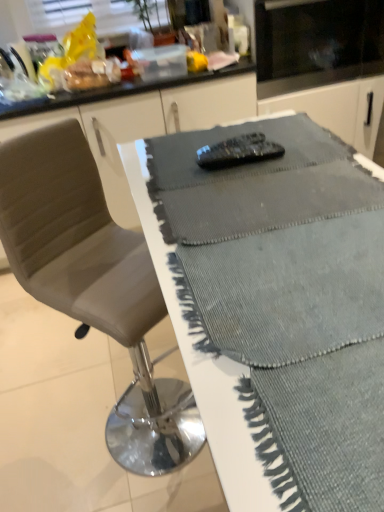
Where is `black glass microwave at upper center`? black glass microwave at upper center is located at coordinates (316, 42).

Locate an element on the screen. chair on the left side of black glass microwave at upper center is located at coordinates (95, 285).

Would you say leather-like gray chair at center is a long distance from black glass microwave at upper center?

Yes, leather-like gray chair at center and black glass microwave at upper center are located far from each other.

From a real-world perspective, is leather-like gray chair at center on top of black glass microwave at upper center?

No, from a real-world perspective, leather-like gray chair at center is not over black glass microwave at upper center

Is leather-like gray chair at center wider than textured gray table at center?

Correct, the width of leather-like gray chair at center exceeds that of textured gray table at center.

Considering the points (52, 204) and (321, 273), which point is behind, point (52, 204) or point (321, 273)?

The point (52, 204) is farther from the camera.

Who is taller, leather-like gray chair at center or textured gray table at center?

With more height is leather-like gray chair at center.

Considering the sizes of leather-like gray chair at center and textured gray table at center in the image, is leather-like gray chair at center bigger or smaller than textured gray table at center?

Considering their sizes, leather-like gray chair at center takes up more space than textured gray table at center.

Which point is more forward, (220, 463) or (300, 35)?

The point (220, 463) is in front.

From a real-world perspective, who is located lower, textured gray table at center or black glass microwave at upper center?

black glass microwave at upper center, from a real-world perspective.

Does textured gray table at center come in front of black glass microwave at upper center?

Yes, it is.

Between textured gray table at center and black glass microwave at upper center, which one has more height?

black glass microwave at upper center.

In order to click on appliance above the textured gray table at center (from the image's perspective) in this screenshot , I will do `click(316, 42)`.

Can you confirm if black glass microwave at upper center is shorter than textured gray table at center?

Incorrect, the height of black glass microwave at upper center does not fall short of that of textured gray table at center.

Which is in front, point (271, 33) or point (293, 471)?

The point (293, 471) is closer.

From a real-world perspective, relative to textured gray table at center, is black glass microwave at upper center vertically above or below?

In terms of real-world spatial position, black glass microwave at upper center is below textured gray table at center.

Is point (225, 210) closer to camera compared to point (140, 282)?

Yes, point (225, 210) is closer to viewer.

From the picture: Is textured gray table at center beside leather-like gray chair at center?

They are not placed beside each other.

Considering the sizes of objects textured gray table at center and leather-like gray chair at center in the image provided, who is wider, textured gray table at center or leather-like gray chair at center?

Wider between the two is leather-like gray chair at center.

Considering the relative sizes of black glass microwave at upper center and leather-like gray chair at center in the image provided, is black glass microwave at upper center thinner than leather-like gray chair at center?

Yes, black glass microwave at upper center is thinner than leather-like gray chair at center.

Based on the photo, how many degrees apart are the facing directions of black glass microwave at upper center and leather-like gray chair at center?

They differ by 90.4 degrees in their facing directions.

Is black glass microwave at upper center far away from leather-like gray chair at center?

black glass microwave at upper center is far away from leather-like gray chair at center.

Is black glass microwave at upper center in front of leather-like gray chair at center?

No, black glass microwave at upper center is further to the viewer.

Locate an element on the screen. The width and height of the screenshot is (384, 512). chair beneath the black glass microwave at upper center (from a real-world perspective) is located at coordinates pos(95,285).

There is a leather-like gray chair at center. Find the location of `table above it (from a real-world perspective)`. table above it (from a real-world perspective) is located at coordinates (276, 310).

When comparing their distances from textured gray table at center, does black glass microwave at upper center or leather-like gray chair at center seem closer?

Among the two, leather-like gray chair at center is located nearer to textured gray table at center.

Estimate the real-world distances between objects in this image. Which object is further from leather-like gray chair at center, black glass microwave at upper center or textured gray table at center?

black glass microwave at upper center is positioned further to the anchor leather-like gray chair at center.

Looking at this image, looking at the image, which one is located closer to black glass microwave at upper center, textured gray table at center or leather-like gray chair at center?

textured gray table at center lies closer to black glass microwave at upper center than the other object.

When comparing their distances from black glass microwave at upper center, does leather-like gray chair at center or textured gray table at center seem further?

leather-like gray chair at center is further to black glass microwave at upper center.

From the image, which object appears to be nearer to textured gray table at center, leather-like gray chair at center or black glass microwave at upper center?

leather-like gray chair at center is positioned closer to the anchor textured gray table at center.

From the image, which object appears to be nearer to leather-like gray chair at center, textured gray table at center or black glass microwave at upper center?

Among the two, textured gray table at center is located nearer to leather-like gray chair at center.

Locate an element on the screen. The height and width of the screenshot is (512, 384). chair between textured gray table at center and black glass microwave at upper center along the z-axis is located at coordinates (95, 285).